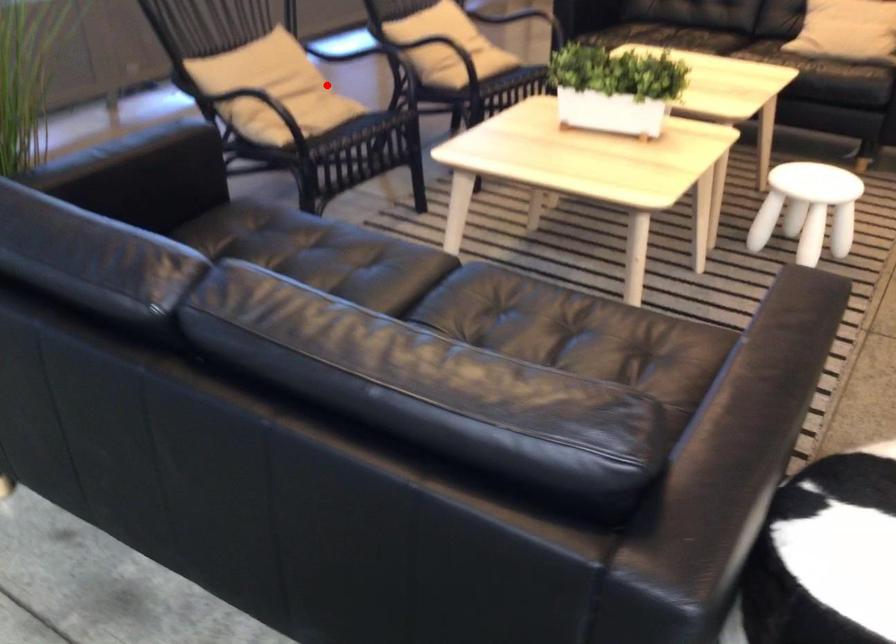
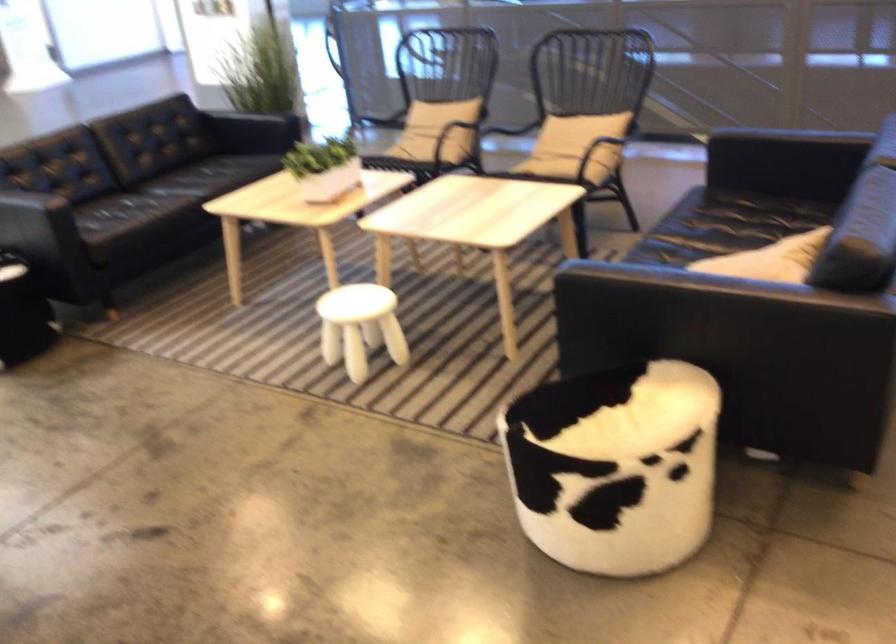
Where in the second image is the point corresponding to the highlighted location from the first image?

(440, 128)